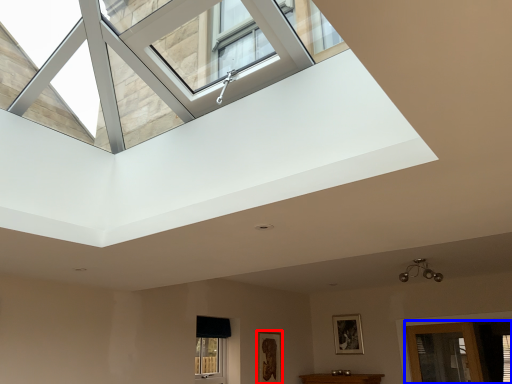
Question: Which object appears closest to the camera in this image, picture frame (highlighted by a red box) or glass door (highlighted by a blue box)?

Choices:
 (A) picture frame
 (B) glass door

Answer: (B)